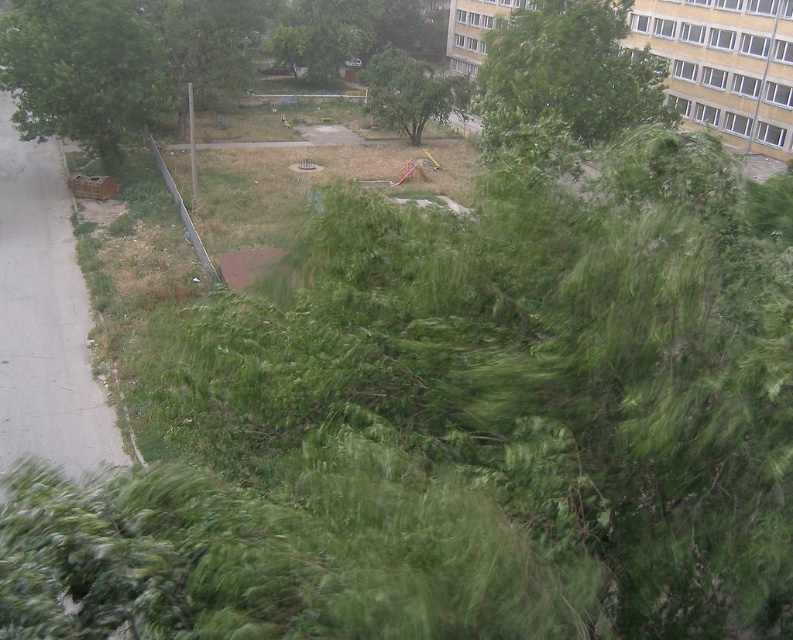
Question: Can you confirm if green leafy tree at left is positioned above green leafy tree at upper center?

Choices:
 (A) no
 (B) yes

Answer: (B)

Question: Which object is farther from the camera taking this photo?

Choices:
 (A) green leafy tree at upper center
 (B) green leafy tree at left

Answer: (B)

Question: Which point is farther to the camera?

Choices:
 (A) green leafy tree at upper center
 (B) green leafy tree at center

Answer: (B)

Question: Does green leafy tree at upper center have a larger size compared to green leafy tree at center?

Choices:
 (A) yes
 (B) no

Answer: (B)

Question: Does green leafy tree at left have a smaller size compared to green leafy tree at upper center?

Choices:
 (A) yes
 (B) no

Answer: (B)

Question: Which point is closer to the camera taking this photo?

Choices:
 (A) (550, 36)
 (B) (112, 65)
 (C) (431, 115)

Answer: (A)